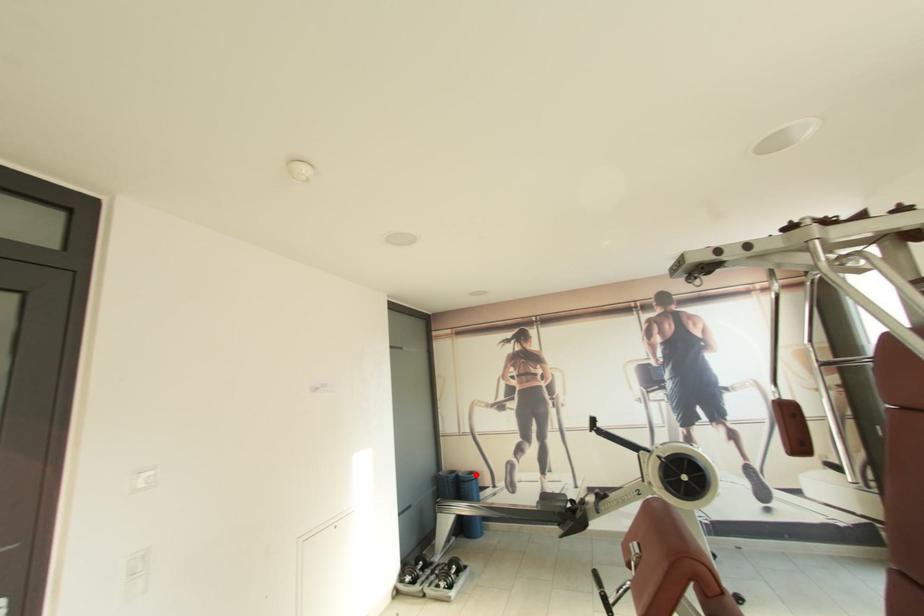
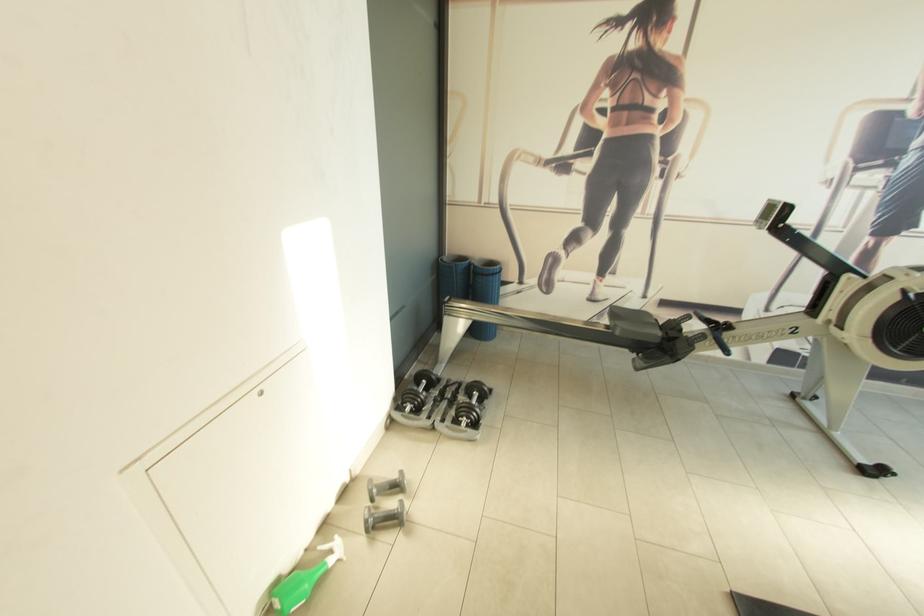
Find the pixel in the second image that matches the highlighted location in the first image.

(497, 265)